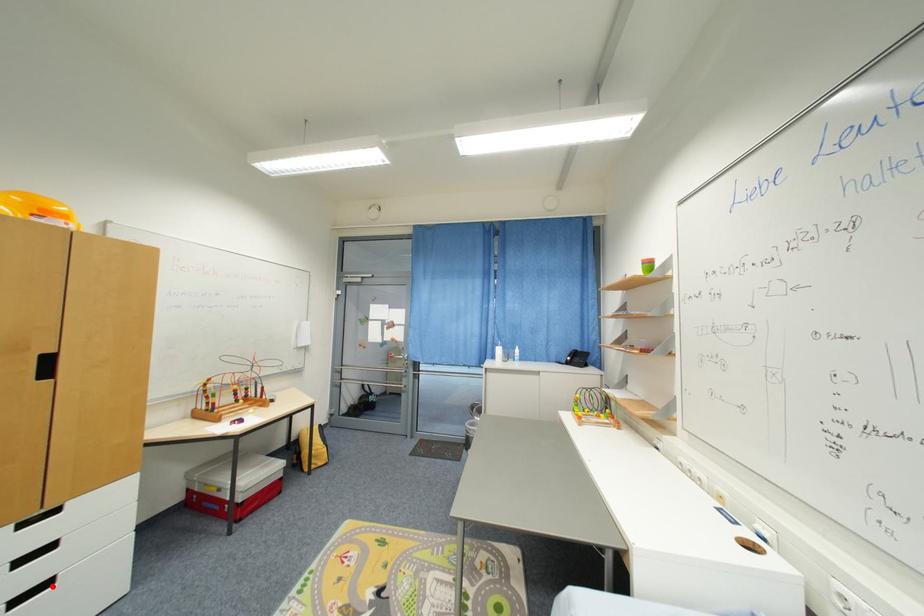
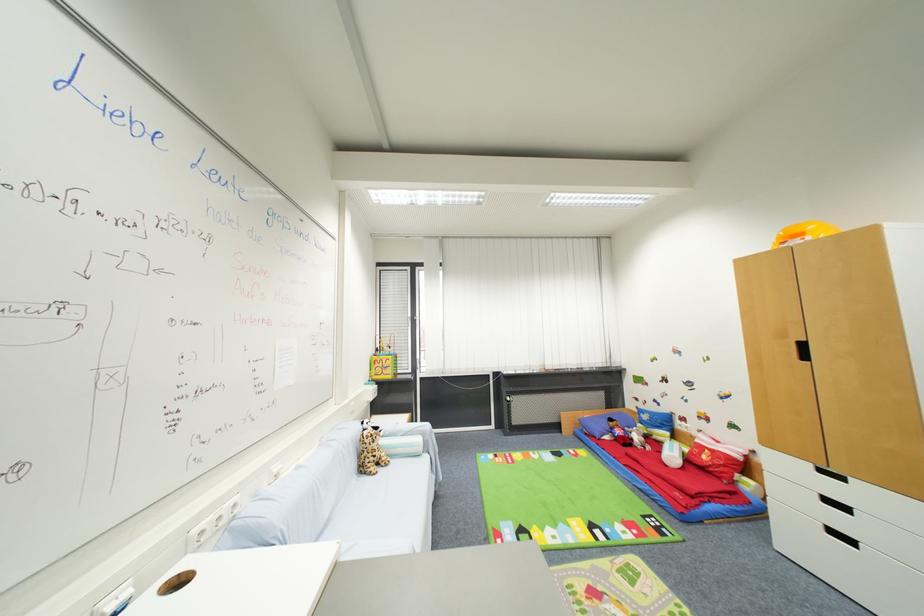
Question: I am providing you with two images of the same scene from different viewpoints. Given a red point in image1, look at the same physical point in image2. Is it:

Choices:
 (A) Closer to the viewpoint
 (B) Farther from the viewpoint

Answer: (A)